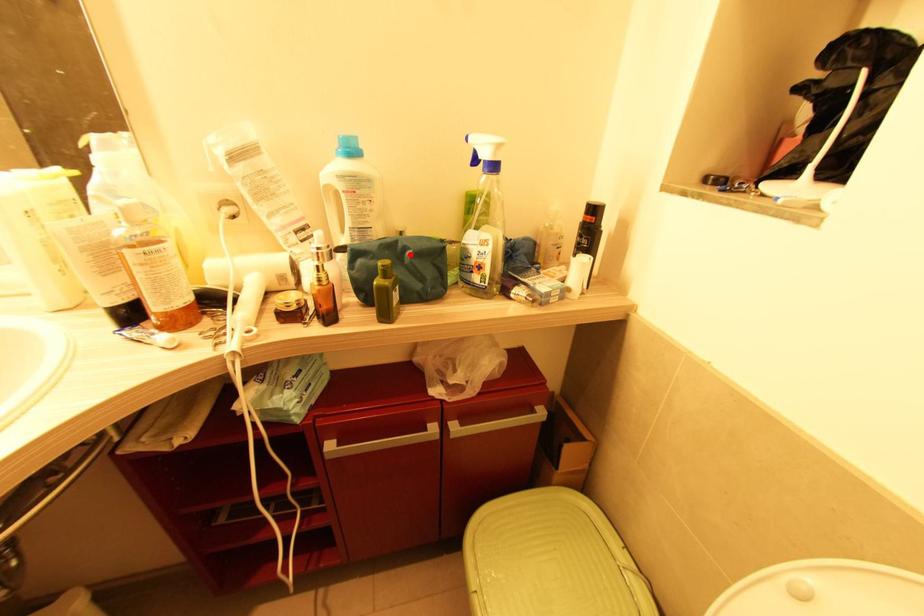
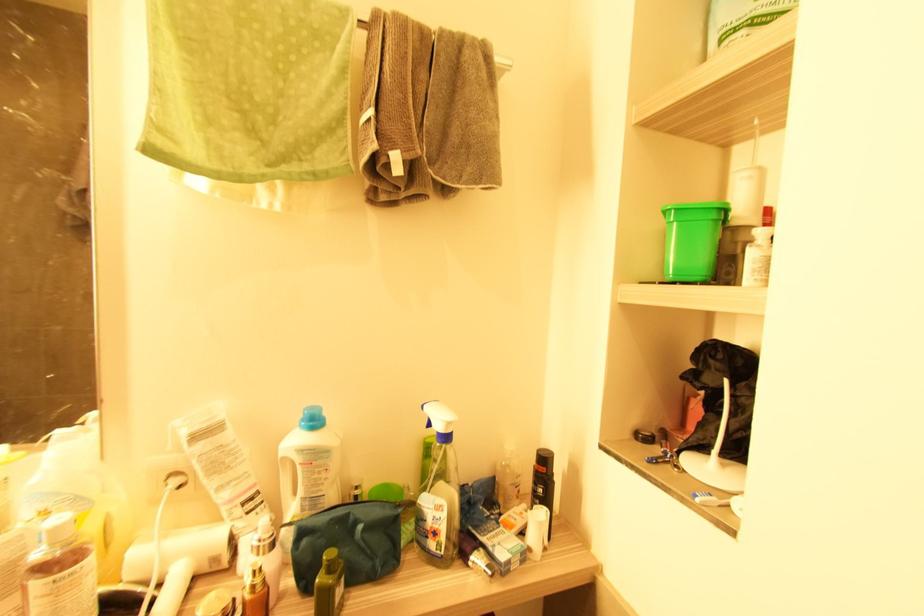
In the second image, find the point that corresponds to the highlighted location in the first image.

(361, 529)